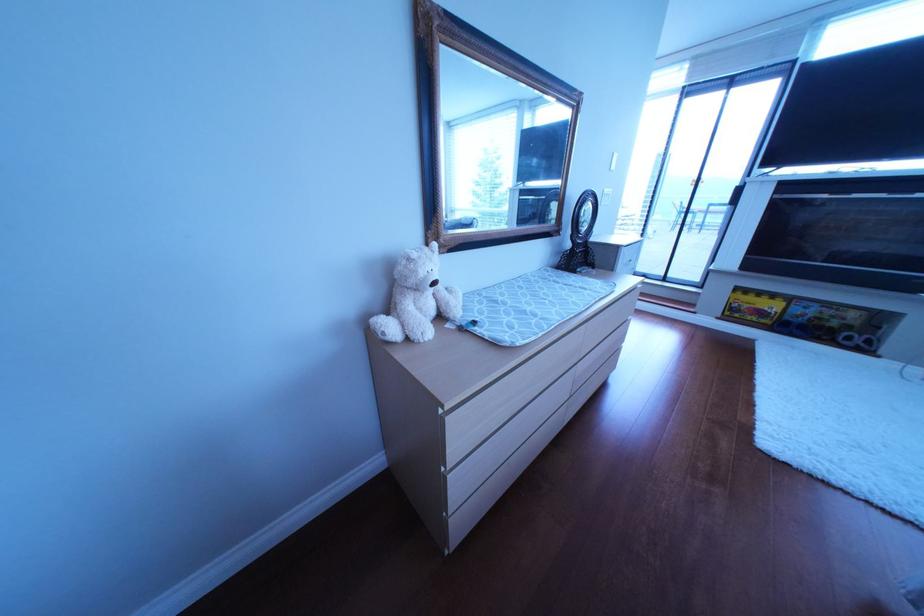
Which object does [584,217] point to?

It refers to a small black mirror.